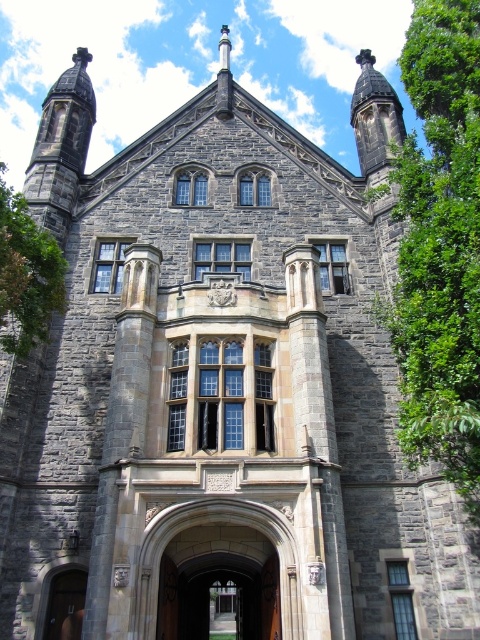
You are standing in front of the grand stone building and want to take a photo of the shield emblem above the central window. To avoid the green leafy tree at left from blocking the view, where should you position yourself relative to the tree?

The green leafy tree at left is located at point (26,275). To avoid it blocking the view of the shield emblem, you should position yourself to the right of the tree so that the tree is out of the frame.